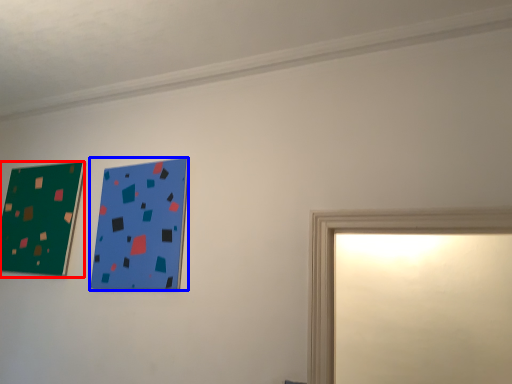
Question: Which of the following is the farthest to the observer, picture frame (highlighted by a red box) or picture frame (highlighted by a blue box)?

Choices:
 (A) picture frame
 (B) picture frame

Answer: (A)